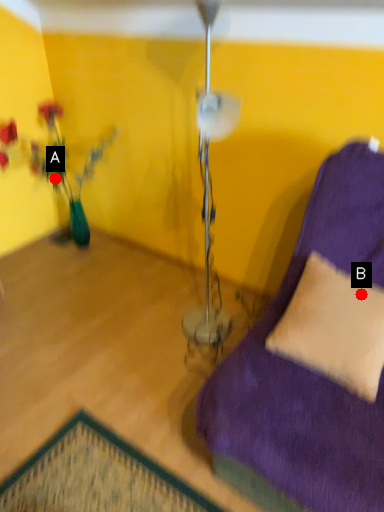
Question: Two points are circled on the image, labeled by A and B beside each circle. Which point is farther from the camera taking this photo?

Choices:
 (A) A is further
 (B) B is further

Answer: (A)